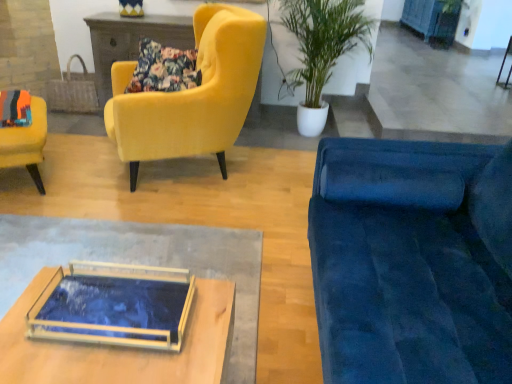
Question: Does green leafy plant in white pot at upper center have a lesser height compared to velvet yellow armchair at left, which is the 1th chair in left-to-right order?

Choices:
 (A) no
 (B) yes

Answer: (A)

Question: Is green leafy plant in white pot at upper center positioned with its back to velvet yellow armchair at left, which is the 1th chair in left-to-right order?

Choices:
 (A) no
 (B) yes

Answer: (A)

Question: Is velvet yellow armchair at left, which is the 1th chair in left-to-right order, inside green leafy plant in white pot at upper center?

Choices:
 (A) yes
 (B) no

Answer: (B)

Question: Is green leafy plant in white pot at upper center positioned before velvet yellow armchair at left, which appears as the 2th chair when viewed from the right?

Choices:
 (A) no
 (B) yes

Answer: (A)

Question: Is green leafy plant in white pot at upper center thinner than velvet yellow armchair at left, which appears as the 2th chair when viewed from the right?

Choices:
 (A) yes
 (B) no

Answer: (B)

Question: From the image's perspective, is green leafy plant in white pot at upper center beneath velvet yellow armchair at left, which appears as the 2th chair when viewed from the right?

Choices:
 (A) yes
 (B) no

Answer: (B)

Question: From a real-world perspective, is velvet blue couch at right on floral fabric pillow at upper left?

Choices:
 (A) no
 (B) yes

Answer: (A)

Question: Could you tell me if velvet blue couch at right is facing floral fabric pillow at upper left?

Choices:
 (A) no
 (B) yes

Answer: (A)

Question: Is floral fabric pillow at upper left completely or partially inside velvet blue couch at right?

Choices:
 (A) yes
 (B) no

Answer: (B)

Question: Is velvet blue couch at right to the left of floral fabric pillow at upper left from the viewer's perspective?

Choices:
 (A) no
 (B) yes

Answer: (A)

Question: Considering the relative sizes of velvet blue couch at right and floral fabric pillow at upper left in the image provided, is velvet blue couch at right taller than floral fabric pillow at upper left?

Choices:
 (A) yes
 (B) no

Answer: (A)

Question: Does velvet blue couch at right have a larger size compared to floral fabric pillow at upper left?

Choices:
 (A) no
 (B) yes

Answer: (B)

Question: Would you say yellow and blue striped vase at upper center is a long distance from blue painted wood cabinet at upper right?

Choices:
 (A) yes
 (B) no

Answer: (A)